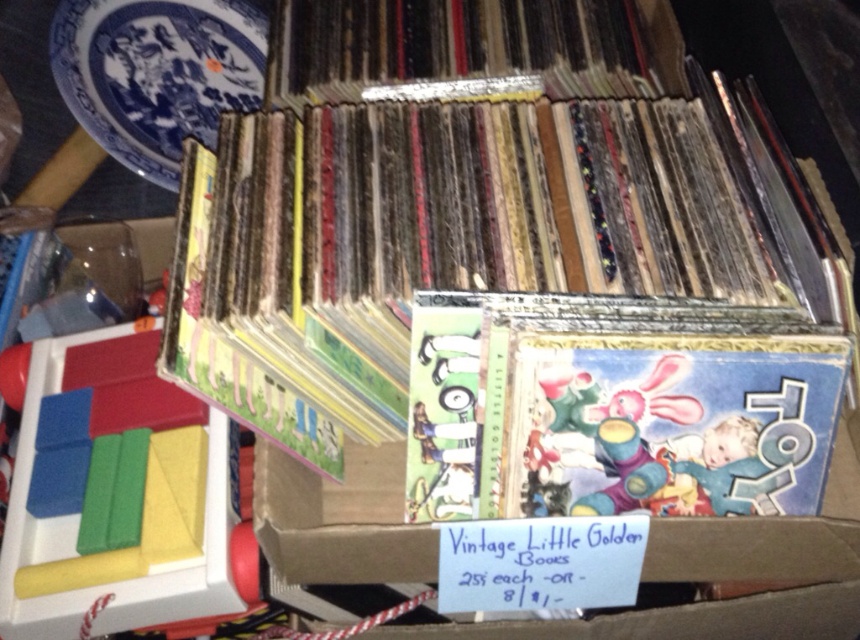
Is point (8, 513) more distant than point (201, 68)?

No, (8, 513) is closer to viewer.

Is point (163, 428) positioned before point (72, 74)?

Yes, it is.

The image size is (860, 640). Identify the location of rubberized plastic blocks at left. (134, 499).